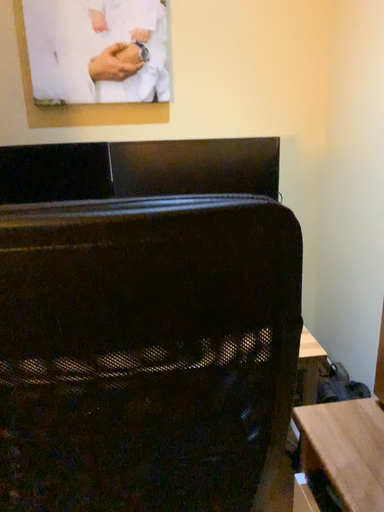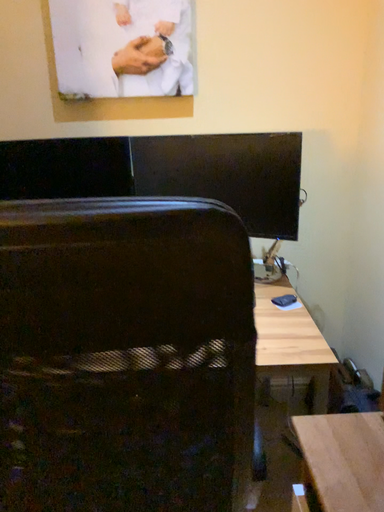
Question: Which way did the camera rotate in the video?

Choices:
 (A) rotated left
 (B) rotated right

Answer: (A)